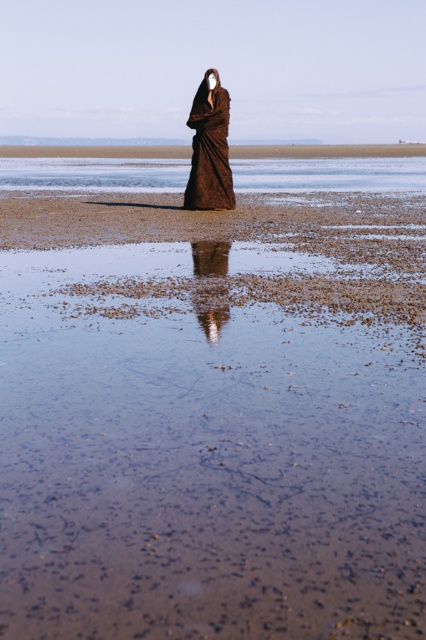
Question: Estimate the real-world distances between objects in this image. Which object is closer to the brown matte sand at center?

Choices:
 (A) clear water at center
 (B) smooth brown hair at center

Answer: (B)

Question: Can you confirm if brown textured robe at center is positioned to the left of smooth brown hair at center?

Choices:
 (A) no
 (B) yes

Answer: (B)

Question: Among these points, which one is farthest from the camera?

Choices:
 (A) (224, 172)
 (B) (184, 166)

Answer: (B)

Question: Can you confirm if brown matte sand at center is wider than smooth brown hair at center?

Choices:
 (A) yes
 (B) no

Answer: (A)

Question: Is clear water at center wider than brown textured robe at center?

Choices:
 (A) no
 (B) yes

Answer: (B)

Question: Which of the following is the farthest from the observer?

Choices:
 (A) (328, 161)
 (B) (209, 74)
 (C) (51, 618)

Answer: (A)